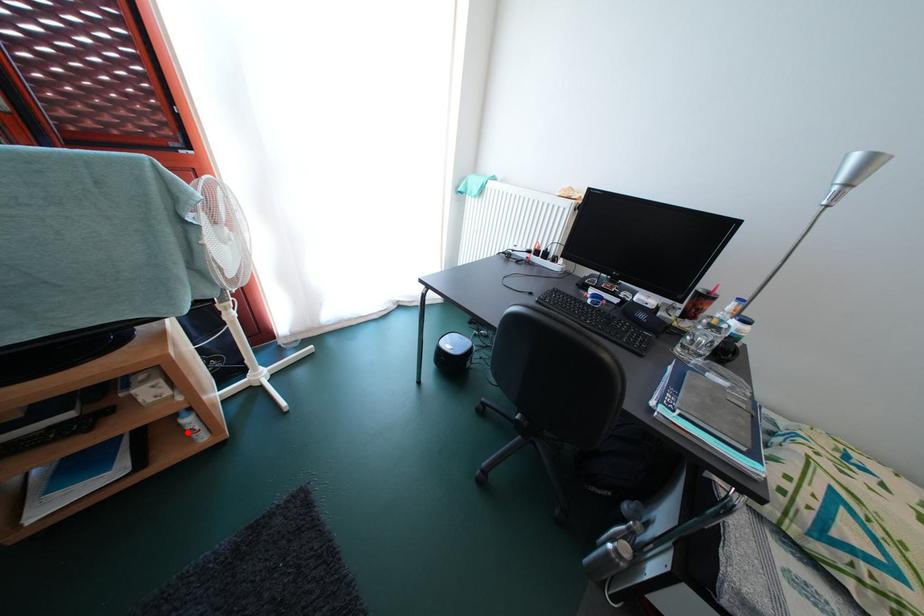
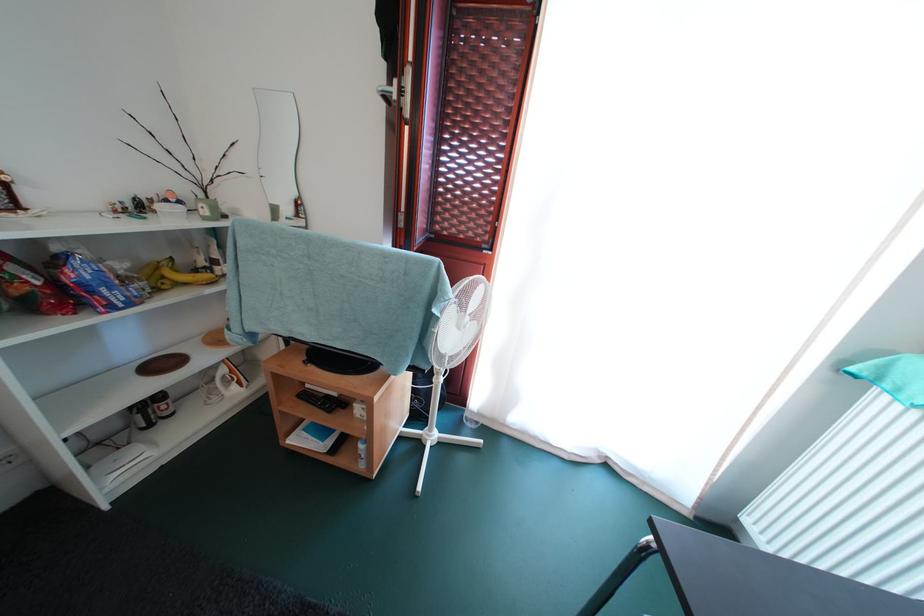
Question: I am providing you with two images of the same scene from different viewpoints. In image1, a red point is highlighted. Considering the same 3D point in image2, which of the following is correct?

Choices:
 (A) It is closer
 (B) It is farther

Answer: (B)